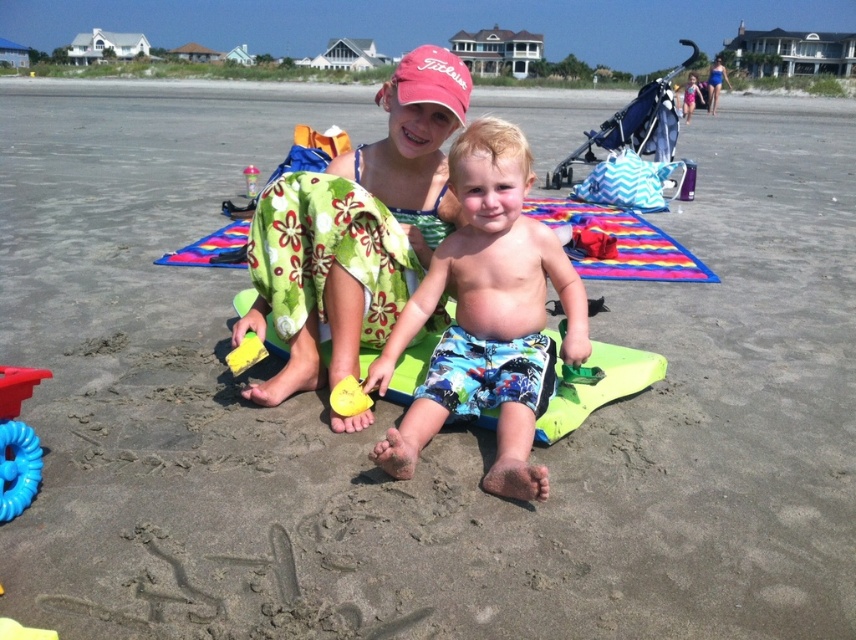
How distant is blue rubber ring at lower left from rubber yellow toy at center?

10.60 centimeters

This screenshot has width=856, height=640. In order to click on blue rubber ring at lower left in this screenshot , I will do pos(16,467).

In order to click on blue rubber ring at lower left in this screenshot , I will do `click(16, 467)`.

Who is shorter, green floral towel at center or yellow plastic shovel at center?

yellow plastic shovel at center

Is green floral towel at center further to the viewer compared to yellow plastic shovel at center?

No, green floral towel at center is in front of yellow plastic shovel at center.

Between point (366, 250) and point (251, 188), which one is positioned in front?

Point (366, 250) is more forward.

Image resolution: width=856 pixels, height=640 pixels. In order to click on green floral towel at center in this screenshot , I will do `click(328, 252)`.

Can you confirm if floral fabric dress at center is shorter than rubber yellow toy at center?

Incorrect, floral fabric dress at center's height does not fall short of rubber yellow toy at center's.

Does point (443, 193) lie in front of point (0, 365)?

No, (443, 193) is behind (0, 365).

At what (x,y) coordinates should I click in order to perform the action: click on floral fabric dress at center. Please return your answer as a coordinate pair (x, y). Image resolution: width=856 pixels, height=640 pixels. Looking at the image, I should click on (355, 230).